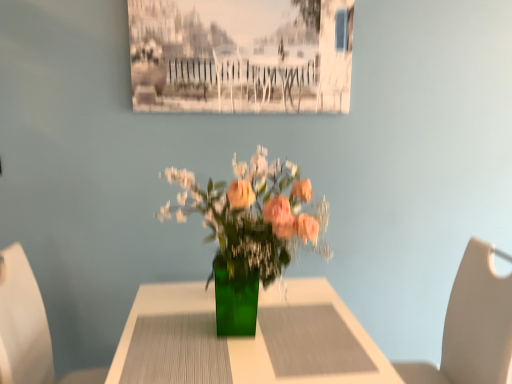
This screenshot has width=512, height=384. I want to click on free space above green glass vase at center (from a real-world perspective), so click(249, 334).